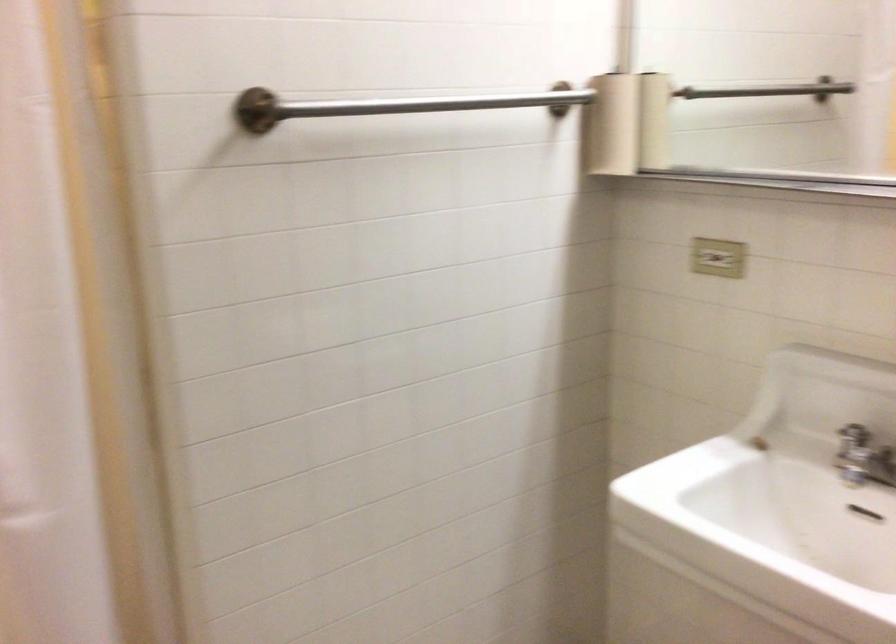
Locate an element on the screen. wall light switch is located at coordinates (716, 263).